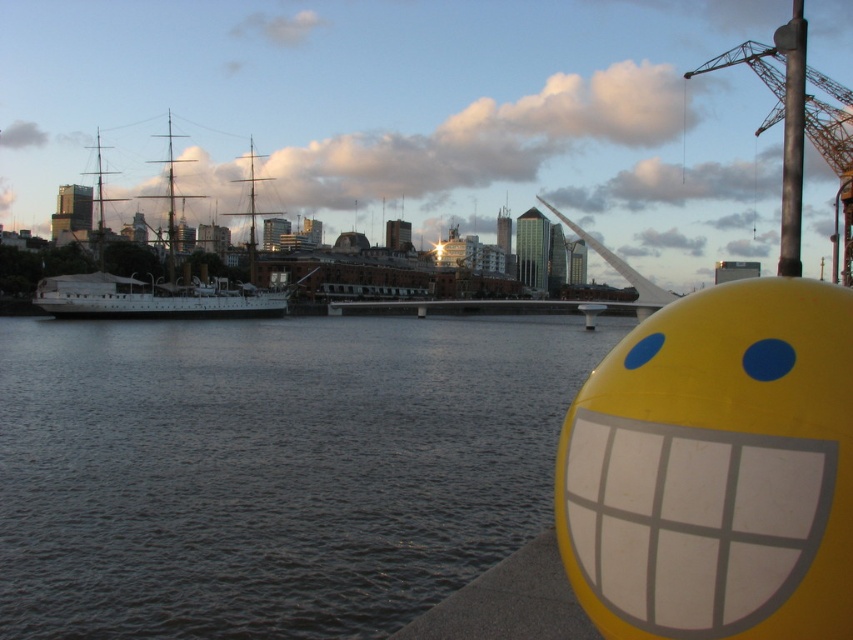
Who is taller, metallic gray crane at upper right or white wooden ship at left?

Standing taller between the two is metallic gray crane at upper right.

Is metallic gray crane at upper right thinner than white wooden ship at left?

Incorrect, metallic gray crane at upper right's width is not less than white wooden ship at left's.

Is point (809, 77) closer to camera compared to point (231, 314)?

That is True.

What are the coordinates of `metallic gray crane at upper right` in the screenshot? It's located at (799, 124).

Is white wooden ship at left taller than rusty metal pole at upper right?

Incorrect, white wooden ship at left's height is not larger of rusty metal pole at upper right's.

Which is in front, point (196, 291) or point (788, 113)?

Positioned in front is point (788, 113).

Does point (50, 282) lie behind point (791, 132)?

Yes, point (50, 282) is farther from viewer.

Find the location of `white wooden ship at left`. white wooden ship at left is located at coordinates (155, 285).

Is dark gray water at lower left shorter than rusty metal pole at upper right?

Yes, dark gray water at lower left is shorter than rusty metal pole at upper right.

Can you confirm if dark gray water at lower left is positioned to the left of rusty metal pole at upper right?

Indeed, dark gray water at lower left is positioned on the left side of rusty metal pole at upper right.

Who is more distant from viewer, (503, 506) or (782, 156)?

The point (782, 156) is more distant.

Identify the location of dark gray water at lower left. The image size is (853, 640). (270, 468).